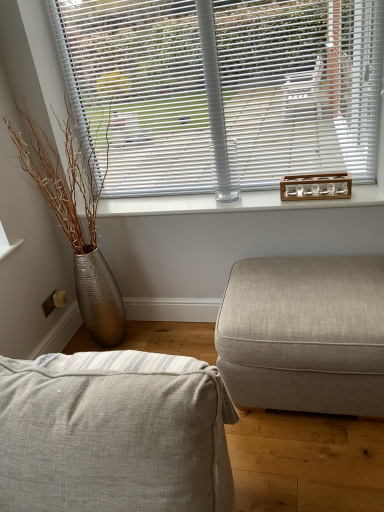
Question: From a real-world perspective, is white plastic blinds at upper center above or below clear glass bottle at center?

Choices:
 (A) below
 (B) above

Answer: (B)

Question: Is white plastic blinds at upper center bigger or smaller than clear glass bottle at center?

Choices:
 (A) big
 (B) small

Answer: (A)

Question: Which object is the closest to the textured beige ottoman at right, acting as the 2th studio couch starting from the left?

Choices:
 (A) white plastic blinds at upper center
 (B) textured beige fabric couch at lower center, which is the 1th studio couch in front-to-back order
 (C) clear glass bottle at center

Answer: (C)

Question: Which of these objects is positioned farthest from the textured beige fabric couch at lower center, which is counted as the second studio couch, starting from the back?

Choices:
 (A) clear glass bottle at center
 (B) textured beige ottoman at right, which ranks as the first studio couch in back-to-front order
 (C) white plastic blinds at upper center

Answer: (C)